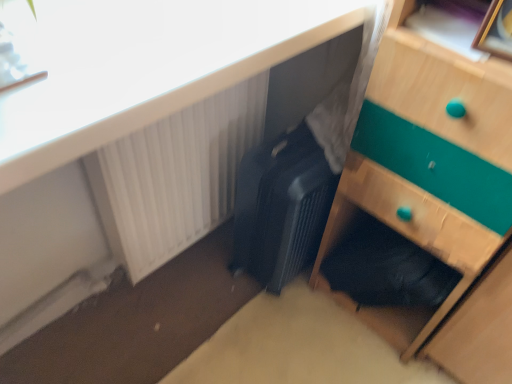
What do you see at coordinates (155, 92) in the screenshot? The height and width of the screenshot is (384, 512). I see `matte black suitcase at center` at bounding box center [155, 92].

What is the approximate height of matte black suitcase at center?

matte black suitcase at center is 1.90 inches tall.

I want to click on white plastic radiator at upper left, so click(175, 176).

You are a GUI agent. You are given a task and a screenshot of the screen. Output one action in this format:
    pyautogui.click(x=<x>, y=<y>)
    Task: Click on the wooden picture frame at upper right
    
    Given the screenshot: What is the action you would take?
    (496, 30)

Where is `matte black suitcase at center`? The height and width of the screenshot is (384, 512). matte black suitcase at center is located at coordinates (155, 92).

Looking at this image, is matte black suitcase at center surrounded by wooden chest of drawers at lower right?

Actually, matte black suitcase at center is outside wooden chest of drawers at lower right.

Does wooden chest of drawers at lower right have a smaller size compared to matte black suitcase at center?

No.

Does wooden chest of drawers at lower right turn towards matte black suitcase at center?

No, wooden chest of drawers at lower right is not oriented towards matte black suitcase at center.

Which object is thinner, wooden picture frame at upper right or matte black suitcase at center?

Thinner between the two is wooden picture frame at upper right.

Considering the positions of point (495, 54) and point (254, 58), is point (495, 54) closer or farther from the camera than point (254, 58)?

Point (495, 54).

From the image's perspective, which one is positioned higher, wooden picture frame at upper right or matte black suitcase at center?

matte black suitcase at center, from the image's perspective.

From the picture: Is wooden picture frame at upper right aimed at matte black suitcase at center?

No.

Locate an element on the screen. The width and height of the screenshot is (512, 384). picture frame that is on the left side of wooden chest of drawers at lower right is located at coordinates (496, 30).

Are wooden chest of drawers at lower right and wooden picture frame at upper right located far from each other?

That's not correct — wooden chest of drawers at lower right is a little close to wooden picture frame at upper right.

Considering the positions of points (452, 225) and (493, 11), is point (452, 225) closer to camera compared to point (493, 11)?

No, it is behind (493, 11).

From the picture: Between wooden chest of drawers at lower right and wooden picture frame at upper right, which one has smaller size?

With smaller size is wooden picture frame at upper right.

Is wooden picture frame at upper right not near wooden chest of drawers at lower right?

No.

Does wooden picture frame at upper right have a greater height compared to wooden chest of drawers at lower right?

Incorrect, the height of wooden picture frame at upper right is not larger of that of wooden chest of drawers at lower right.

From a real-world perspective, which object stands above the other?

wooden picture frame at upper right, from a real-world perspective.

Is point (490, 27) positioned before point (388, 80)?

Yes, point (490, 27) is closer to viewer.

Can you confirm if white plastic radiator at upper left is wider than wooden picture frame at upper right?

Yes, white plastic radiator at upper left is wider than wooden picture frame at upper right.

Considering the points (145, 148) and (495, 31), which point is in front, point (145, 148) or point (495, 31)?

Positioned in front is point (495, 31).

How different are the orientations of white plastic radiator at upper left and wooden picture frame at upper right in degrees?

white plastic radiator at upper left and wooden picture frame at upper right are facing 79.1 degrees away from each other.

From a real-world perspective, is white plastic radiator at upper left above or below wooden picture frame at upper right?

white plastic radiator at upper left is below wooden picture frame at upper right.

Can you confirm if black textured suitcase at center is shorter than white plastic radiator at upper left?

Correct, black textured suitcase at center is not as tall as white plastic radiator at upper left.

Is point (322, 208) positioned before point (178, 222)?

That is True.

Does black textured suitcase at center appear on the right side of white plastic radiator at upper left?

Indeed, black textured suitcase at center is positioned on the right side of white plastic radiator at upper left.

Considering the sizes of objects black textured suitcase at center and white plastic radiator at upper left in the image provided, who is wider, black textured suitcase at center or white plastic radiator at upper left?

black textured suitcase at center.

In the scene shown: How far apart are matte black suitcase at center and wooden chest of drawers at lower right?

matte black suitcase at center is 22.36 inches away from wooden chest of drawers at lower right.

Can you confirm if matte black suitcase at center is wider than wooden chest of drawers at lower right?

Yes, matte black suitcase at center is wider than wooden chest of drawers at lower right.

Considering the sizes of objects matte black suitcase at center and wooden chest of drawers at lower right in the image provided, who is shorter, matte black suitcase at center or wooden chest of drawers at lower right?

With less height is matte black suitcase at center.

Does point (174, 44) appear closer or farther from the camera than point (497, 103)?

Clearly, point (174, 44) is closer to the camera than point (497, 103).

Where is `the chest of drawers that appears below the matte black suitcase at center (from a real-world perspective)`? This screenshot has width=512, height=384. the chest of drawers that appears below the matte black suitcase at center (from a real-world perspective) is located at coordinates (430, 205).

Locate an element on the screen. Image resolution: width=512 pixels, height=384 pixels. picture frame above the matte black suitcase at center (from a real-world perspective) is located at coordinates (496, 30).

Considering their positions, is black textured suitcase at center positioned further to white plastic radiator at upper left than wooden picture frame at upper right?

wooden picture frame at upper right.

When comparing their distances from matte black suitcase at center, does wooden picture frame at upper right or wooden chest of drawers at lower right seem closer?

Based on the image, wooden chest of drawers at lower right appears to be nearer to matte black suitcase at center.

From the image, which object appears to be nearer to wooden picture frame at upper right, white plastic radiator at upper left or matte black suitcase at center?

white plastic radiator at upper left is closer to wooden picture frame at upper right.

Looking at the image, which one is located further to black textured suitcase at center, matte black suitcase at center or wooden chest of drawers at lower right?

Among the two, matte black suitcase at center is located further to black textured suitcase at center.

Looking at the image, which one is located further to wooden chest of drawers at lower right, black textured suitcase at center or white plastic radiator at upper left?

white plastic radiator at upper left is positioned further to the anchor wooden chest of drawers at lower right.

Looking at the image, which one is located further to wooden picture frame at upper right, wooden chest of drawers at lower right or black textured suitcase at center?

black textured suitcase at center.

From the picture: Looking at the image, which one is located closer to white plastic radiator at upper left, wooden picture frame at upper right or black textured suitcase at center?

black textured suitcase at center lies closer to white plastic radiator at upper left than the other object.

Based on the photo, based on their spatial positions, is wooden picture frame at upper right or white plastic radiator at upper left further from black textured suitcase at center?

wooden picture frame at upper right is positioned further to the anchor black textured suitcase at center.

Where is `luggage between white plastic radiator at upper left and wooden picture frame at upper right from left to right`? luggage between white plastic radiator at upper left and wooden picture frame at upper right from left to right is located at coordinates (281, 208).

Locate an element on the screen. The image size is (512, 384). picture frame between white plastic radiator at upper left and wooden chest of drawers at lower right from left to right is located at coordinates (496, 30).

Locate an element on the screen. The image size is (512, 384). picture frame between wooden chest of drawers at lower right and black textured suitcase at center from front to back is located at coordinates (496, 30).

This screenshot has height=384, width=512. Find the location of `luggage located between matte black suitcase at center and wooden chest of drawers at lower right in the left-right direction`. luggage located between matte black suitcase at center and wooden chest of drawers at lower right in the left-right direction is located at coordinates pos(281,208).